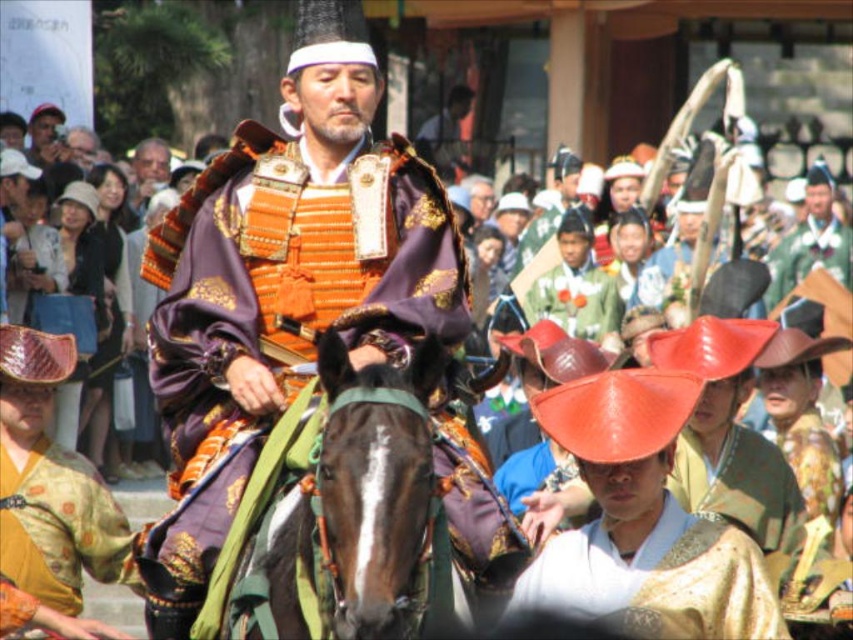
Which is in front, point (194, 250) or point (310, 616)?

Point (310, 616) is more forward.

Which is behind, point (332, 310) or point (451, 604)?

Positioned behind is point (332, 310).

Is point (231, 541) positioned after point (408, 445)?

Yes, it is.

The image size is (853, 640). I want to click on orange metallic armor at center, so click(282, 305).

Does orange metallic armor at center appear under gold textured kimono at center?

Incorrect, orange metallic armor at center is not positioned below gold textured kimono at center.

Is the position of orange metallic armor at center less distant than that of gold textured kimono at center?

Yes, orange metallic armor at center is closer to the viewer.

Image resolution: width=853 pixels, height=640 pixels. What are the coordinates of `orange metallic armor at center` in the screenshot? It's located at (282, 305).

Between brown glossy horse at center and gold textured kimono at center, which one has more height?

With more height is gold textured kimono at center.

Is point (415, 612) in front of point (587, 589)?

That is True.

This screenshot has width=853, height=640. I want to click on brown glossy horse at center, so click(x=347, y=518).